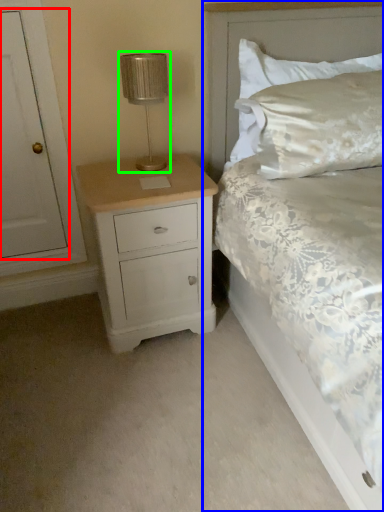
Question: Which object is the farthest from door (highlighted by a red box)? Choose among these: bed (highlighted by a blue box) or table lamp (highlighted by a green box).

Choices:
 (A) bed
 (B) table lamp

Answer: (A)